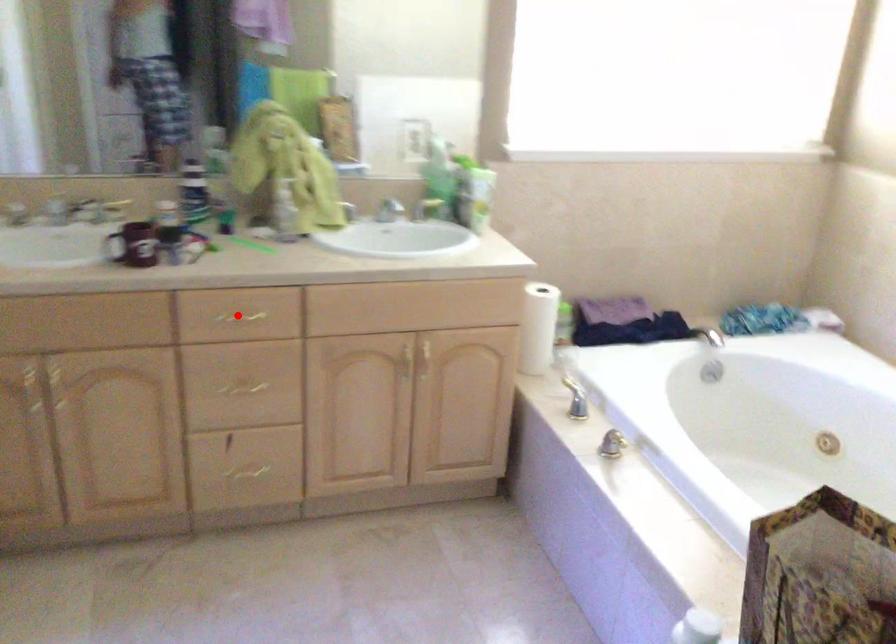
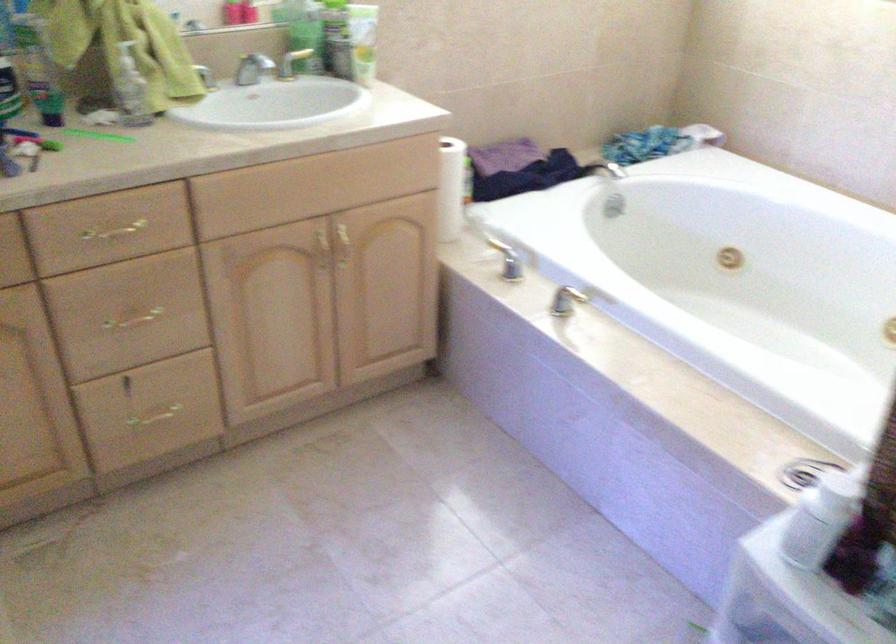
In the second image, find the point that corresponds to the highlighted location in the first image.

(114, 230)